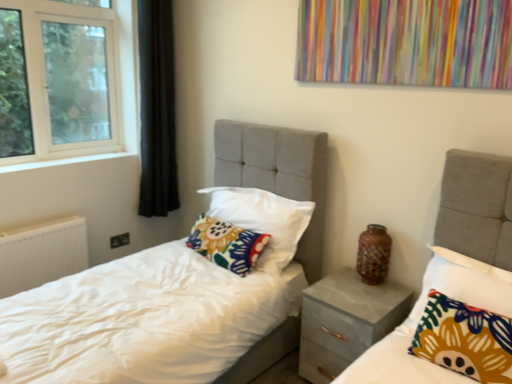
Question: Would you say floral fabric pillow at center, which appears as the first pillow when viewed from the back, is a long distance from floral fabric pillow at center, positioned as the 2th pillow in front-to-back order?

Choices:
 (A) no
 (B) yes

Answer: (A)

Question: Is floral fabric pillow at center, which is the 3th pillow from front to back, positioned behind floral fabric pillow at center, positioned as the 2th pillow in front-to-back order?

Choices:
 (A) no
 (B) yes

Answer: (B)

Question: Does floral fabric pillow at center, which is the 3th pillow from front to back, have a smaller size compared to floral fabric pillow at center, positioned as the 2th pillow in front-to-back order?

Choices:
 (A) yes
 (B) no

Answer: (A)

Question: Considering the relative sizes of floral fabric pillow at center, which is the 3th pillow from front to back, and floral fabric pillow at center, the 2th pillow from the back, in the image provided, is floral fabric pillow at center, which is the 3th pillow from front to back, wider than floral fabric pillow at center, the 2th pillow from the back,?

Choices:
 (A) no
 (B) yes

Answer: (A)

Question: Is floral fabric pillow at center, which appears as the first pillow when viewed from the back, oriented towards floral fabric pillow at center, the 2th pillow from the back?

Choices:
 (A) no
 (B) yes

Answer: (B)

Question: Considering the relative positions of floral fabric pillow at center, positioned as the 2th pillow in front-to-back order, and matte gray nightstand at center in the image provided, is floral fabric pillow at center, positioned as the 2th pillow in front-to-back order, to the left or to the right of matte gray nightstand at center?

Choices:
 (A) right
 (B) left

Answer: (B)

Question: Is point (286, 264) positioned closer to the camera than point (309, 286)?

Choices:
 (A) closer
 (B) farther

Answer: (B)

Question: From the image's perspective, is floral fabric pillow at center, the 2th pillow from the back, above or below matte gray nightstand at center?

Choices:
 (A) above
 (B) below

Answer: (A)

Question: In the image, is floral fabric pillow at center, positioned as the 2th pillow in front-to-back order, positioned in front of or behind matte gray nightstand at center?

Choices:
 (A) behind
 (B) front

Answer: (A)

Question: Is point click(230, 208) positioned closer to the camera than point click(368, 271)?

Choices:
 (A) farther
 (B) closer

Answer: (A)

Question: Based on their positions, is floral fabric pillow at center, positioned as the 2th pillow in front-to-back order, located to the left or right of shiny mosaic vase at center?

Choices:
 (A) right
 (B) left

Answer: (B)

Question: From the image's perspective, relative to shiny mosaic vase at center, is floral fabric pillow at center, the 2th pillow from the back, above or below?

Choices:
 (A) below
 (B) above

Answer: (B)

Question: Is floral fabric pillow at center, positioned as the 2th pillow in front-to-back order, wider or thinner than shiny mosaic vase at center?

Choices:
 (A) wide
 (B) thin

Answer: (A)

Question: Relative to white textured radiator at lower left, is floral fabric pillow at center, which appears as the first pillow when viewed from the back, in front or behind?

Choices:
 (A) behind
 (B) front

Answer: (B)

Question: Does point (187, 238) appear closer or farther from the camera than point (1, 296)?

Choices:
 (A) closer
 (B) farther

Answer: (B)